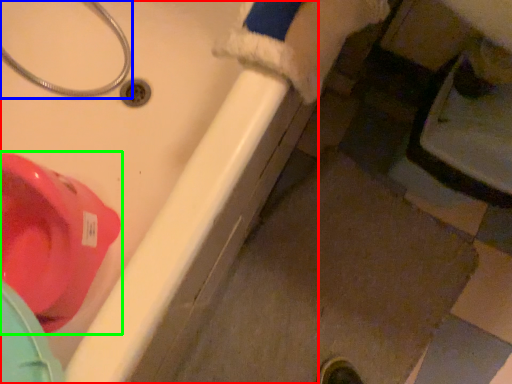
Question: Considering the real-world distances, which object is closest to bath (highlighted by a red box)? plumbing fixture (highlighted by a blue box) or toilet (highlighted by a green box).

Choices:
 (A) plumbing fixture
 (B) toilet

Answer: (B)